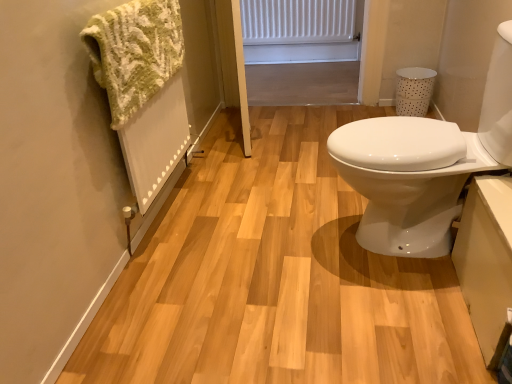
Question: Is point (117, 92) positioned closer to the camera than point (381, 167)?

Choices:
 (A) farther
 (B) closer

Answer: (A)

Question: From the image's perspective, is green knitted towel at left positioned above or below white glossy sink at right?

Choices:
 (A) above
 (B) below

Answer: (A)

Question: Estimate the real-world distances between objects in this image. Which object is closer to the white glossy sink at right?

Choices:
 (A) green knitted towel at left
 (B) white matte radiator at upper center

Answer: (A)

Question: Estimate the real-world distances between objects in this image. Which object is closer to the white matte radiator at upper center?

Choices:
 (A) green knitted towel at left
 (B) white glossy sink at right

Answer: (A)